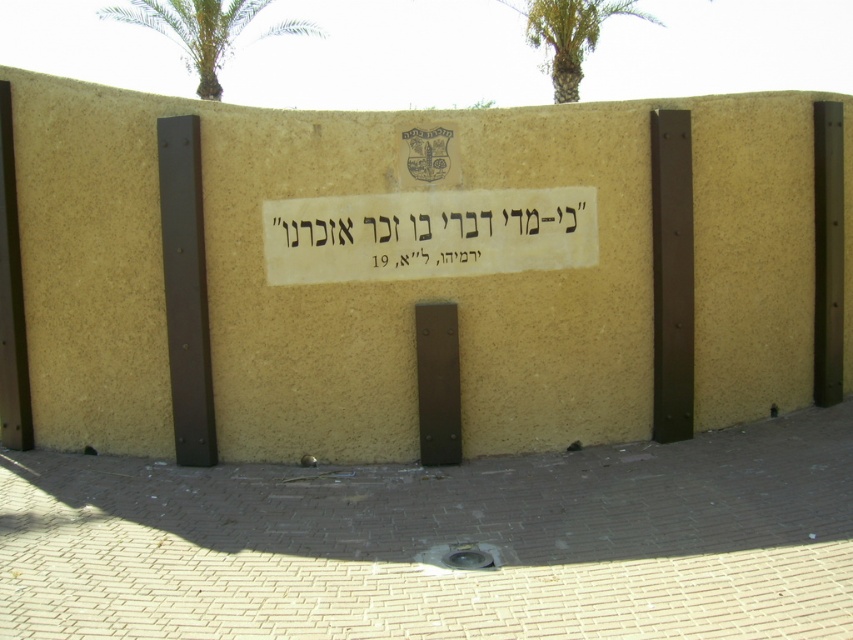
Is green leafy palm tree at upper left above green leafy palm tree at upper center?

Indeed, green leafy palm tree at upper left is positioned over green leafy palm tree at upper center.

Who is more distant from viewer, (190, 4) or (596, 36)?

Positioned behind is point (190, 4).

I want to click on green leafy palm tree at upper left, so click(x=193, y=29).

Consider the image. Can you confirm if white paper sign at center is thinner than green leafy palm tree at upper center?

Incorrect, white paper sign at center's width is not less than green leafy palm tree at upper center's.

Who is more distant from viewer, [495,272] or [554,29]?

The point [554,29] is behind.

Where is `white paper sign at center`? white paper sign at center is located at coordinates (428, 234).

Does point (424, 198) lie behind point (239, 33)?

That is False.

Who is lower down, white paper sign at center or green leafy palm tree at upper left?

Positioned lower is white paper sign at center.

Where is `white paper sign at center`? Image resolution: width=853 pixels, height=640 pixels. white paper sign at center is located at coordinates (428, 234).